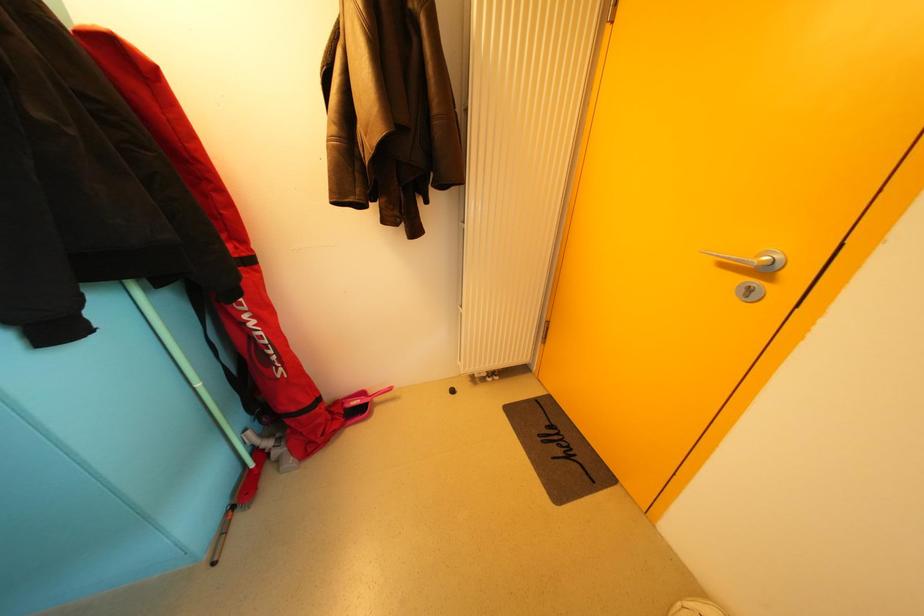
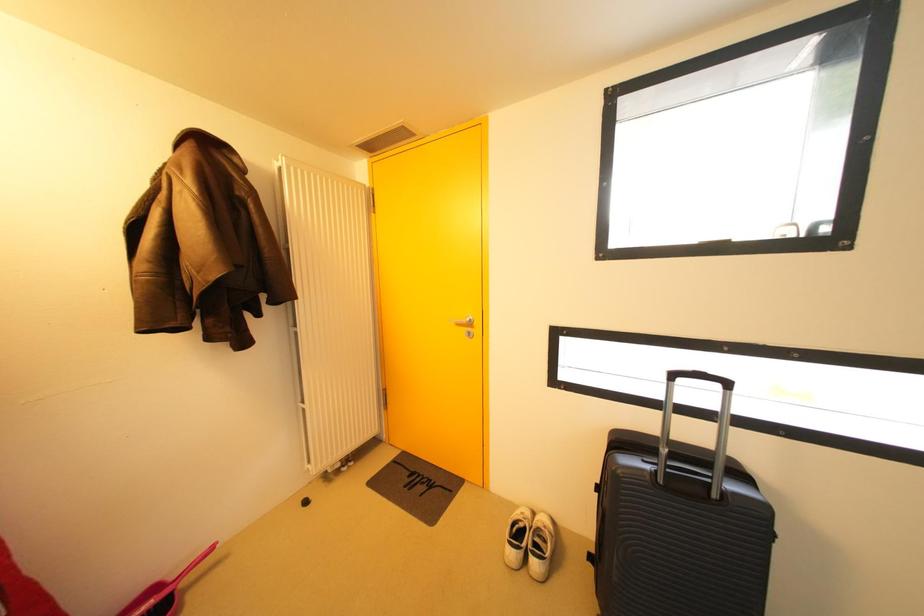
Question: How did the camera likely rotate?

Choices:
 (A) Left
 (B) Right
 (C) Up
 (D) Down

Answer: (B)